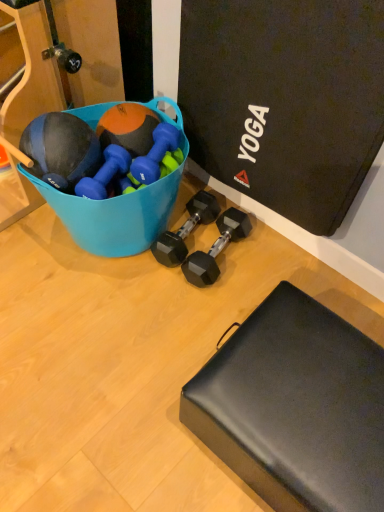
Where is `vacant area that lies between blue plastic bucket at upper left and black rubber dumbbell at center, arranged as the 2th dumbbell when viewed from the right`? vacant area that lies between blue plastic bucket at upper left and black rubber dumbbell at center, arranged as the 2th dumbbell when viewed from the right is located at coordinates (148, 280).